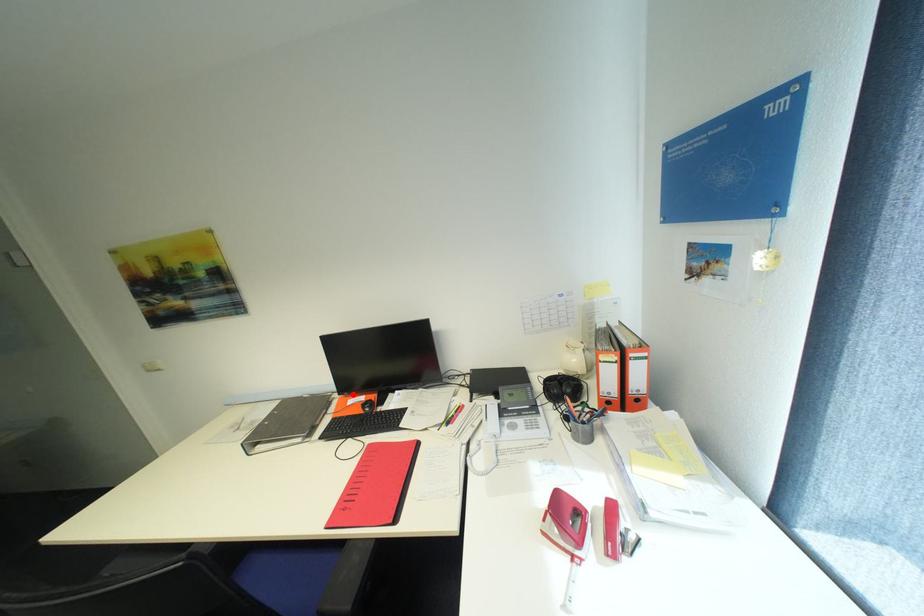
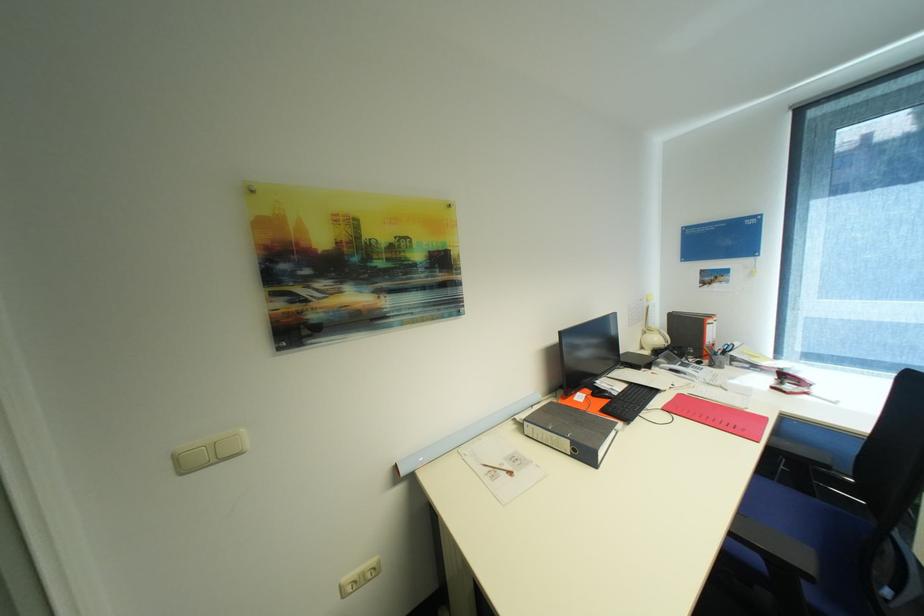
In the second image, find the point that corresponds to the highlighted location in the first image.

(581, 392)